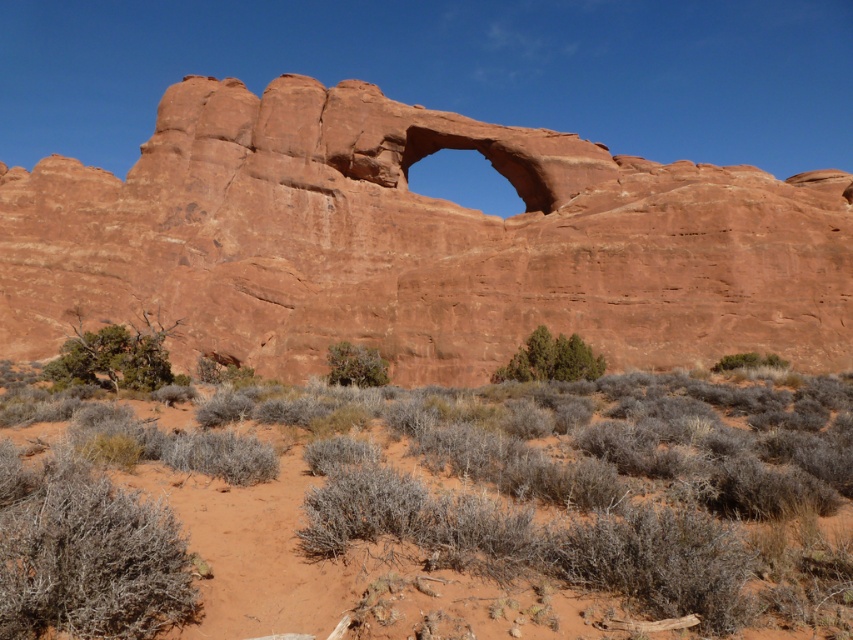
Question: Does brown sandy ground at lower center appear on the right side of green leafy shrub at lower left?

Choices:
 (A) no
 (B) yes

Answer: (B)

Question: Is green leafy shrub at center below green shrub at center?

Choices:
 (A) yes
 (B) no

Answer: (B)

Question: Which of the following is the closest to the observer?

Choices:
 (A) (151, 388)
 (B) (519, 352)

Answer: (A)

Question: Which point appears farthest from the camera in this image?

Choices:
 (A) (122, 352)
 (B) (538, 374)

Answer: (A)

Question: Does brown sandy ground at lower center come in front of green leafy shrub at lower left?

Choices:
 (A) yes
 (B) no

Answer: (A)

Question: Estimate the real-world distances between objects in this image. Which object is closer to the green leafy shrub at lower left?

Choices:
 (A) green shrub at center
 (B) brown sandy ground at lower center

Answer: (A)